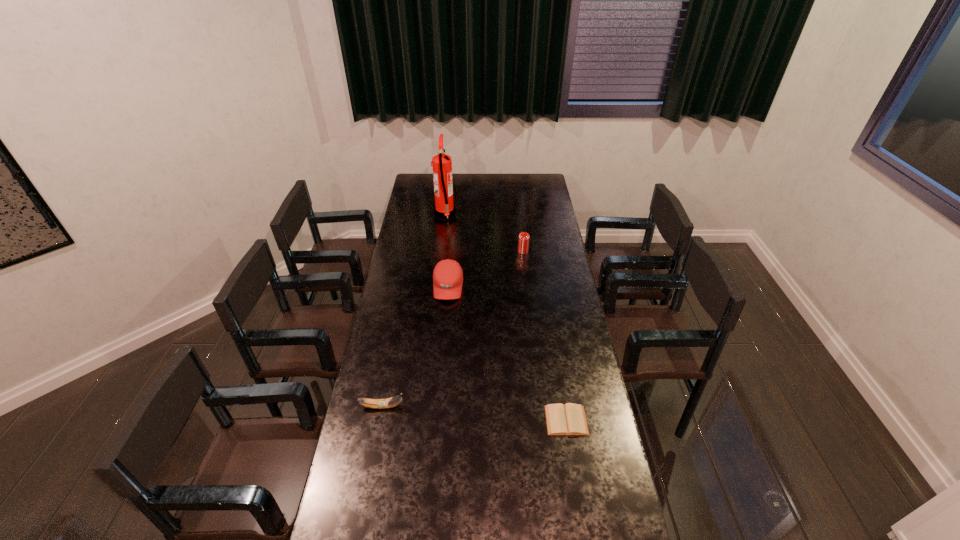
Find the location of `vacant region that satisfies the following two spatial constraints: 1. with the nozzle aimed from the tallest object; 2. on the left side of the second farthest object`. vacant region that satisfies the following two spatial constraints: 1. with the nozzle aimed from the tallest object; 2. on the left side of the second farthest object is located at coordinates (441, 251).

Identify the location of free space that satisfies the following two spatial constraints: 1. on the front side of the beer can; 2. on the left side of the diary. The height and width of the screenshot is (540, 960). (543, 420).

This screenshot has height=540, width=960. Identify the location of vacant point that satisfies the following two spatial constraints: 1. with the nozzle aimed from the fire extinguisher; 2. on the back side of the shortest object. (422, 420).

You are a GUI agent. You are given a task and a screenshot of the screen. Output one action in this format:
    pyautogui.click(x=<x>, y=<y>)
    Task: Click on the vacant area that satisfies the following two spatial constraints: 1. on the front-facing side of the cap; 2. on the peel of the leftmost object
    The height and width of the screenshot is (540, 960).
    Given the screenshot: What is the action you would take?
    pyautogui.click(x=439, y=407)

Find the location of a particular element. This screenshot has height=540, width=960. vacant space that satisfies the following two spatial constraints: 1. with the nozzle aimed from the fire extinguisher; 2. on the back side of the shortest object is located at coordinates (422, 420).

At what (x,y) coordinates should I click in order to perform the action: click on vacant space that satisfies the following two spatial constraints: 1. with the nozzle aimed from the diary; 2. on the right side of the tallest object. Please return your answer as a coordinate pair (x, y). The width and height of the screenshot is (960, 540). Looking at the image, I should click on (422, 420).

Identify the location of free space that satisfies the following two spatial constraints: 1. with the nozzle aimed from the fire extinguisher; 2. on the right side of the shortest object. (422, 420).

Locate an element on the screen. The width and height of the screenshot is (960, 540). free location that satisfies the following two spatial constraints: 1. on the front-facing side of the third farthest object; 2. on the right side of the diary is located at coordinates 437,420.

This screenshot has width=960, height=540. I want to click on free space that satisfies the following two spatial constraints: 1. on the front-facing side of the cap; 2. on the peel of the leftmost object, so click(439, 407).

Find the location of a particular element. vacant position in the image that satisfies the following two spatial constraints: 1. on the peel of the banana; 2. on the back side of the diary is located at coordinates (379, 420).